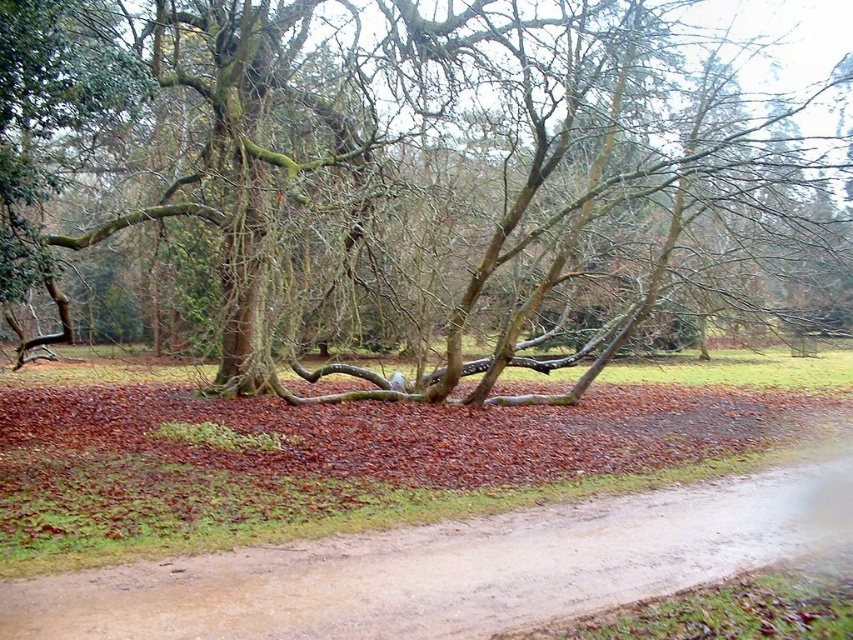
Is green mossy tree trunk at center wider than dirt road at center?

Yes.

Looking at this image, is the position of green mossy tree trunk at center more distant than that of dirt road at center?

Yes, green mossy tree trunk at center is behind dirt road at center.

Find the location of `green mossy tree trunk at center`. green mossy tree trunk at center is located at coordinates (426, 176).